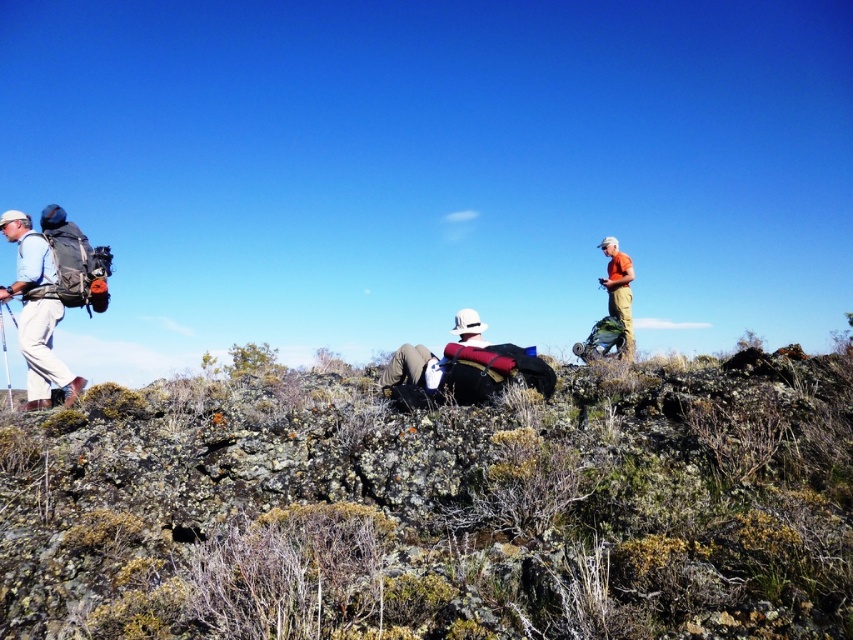
Is matte black backpack at left thinner than orange fabric shirt at upper right?

In fact, matte black backpack at left might be wider than orange fabric shirt at upper right.

The height and width of the screenshot is (640, 853). In order to click on matte black backpack at left in this screenshot , I will do `click(38, 310)`.

Between green mossy rock at center and orange fabric shirt at upper right, which one appears on the left side from the viewer's perspective?

green mossy rock at center is more to the left.

Can you confirm if green mossy rock at center is smaller than orange fabric shirt at upper right?

Incorrect, green mossy rock at center is not smaller in size than orange fabric shirt at upper right.

Between point (167, 394) and point (614, 262), which one is positioned behind?

Positioned behind is point (614, 262).

Image resolution: width=853 pixels, height=640 pixels. In order to click on green mossy rock at center in this screenshot , I will do `click(438, 508)`.

Can you confirm if green mossy rock at center is positioned to the left of matte black backpack at left?

No, green mossy rock at center is not to the left of matte black backpack at left.

Which is in front, point (181, 397) or point (26, 394)?

Point (181, 397) is in front.

The image size is (853, 640). I want to click on green mossy rock at center, so click(x=438, y=508).